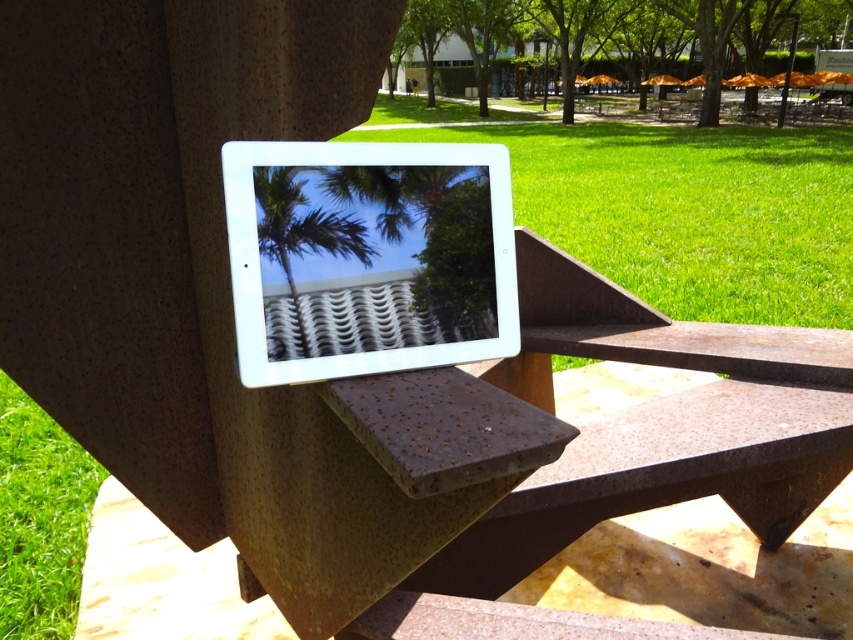
You are standing in the outdoor area and want to walk from the tablet on the bench to the green grass at lower left. Which direction should you move relative to the green grass at center?

The green grass at center is in front of the green grass at lower left. To reach the green grass at lower left, you should move behind the green grass at center.

You are standing in the outdoor area shown in the image. You want to place a small potted plant that is 12 inches tall on the ground. Where should you place it so that it is closest to the green grass at center without being on top of it?

The green grass at center is 39.37 inches away from the viewer. Since the potted plant is 12 inches tall, you can place it near the green grass at center but at least 12 inches away from it to ensure it is closest without being on top.

You are standing in the outdoor area shown in the image. You see the green grass at center and the green leafy palm tree at upper center. Which object is positioned to the right of the other?

The green grass at center is to the right of the green leafy palm tree at upper center.